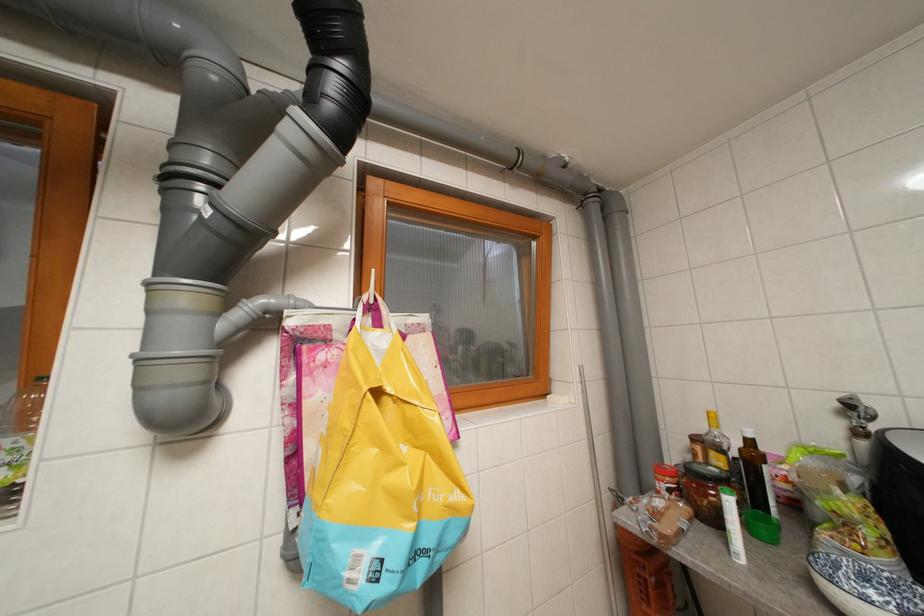
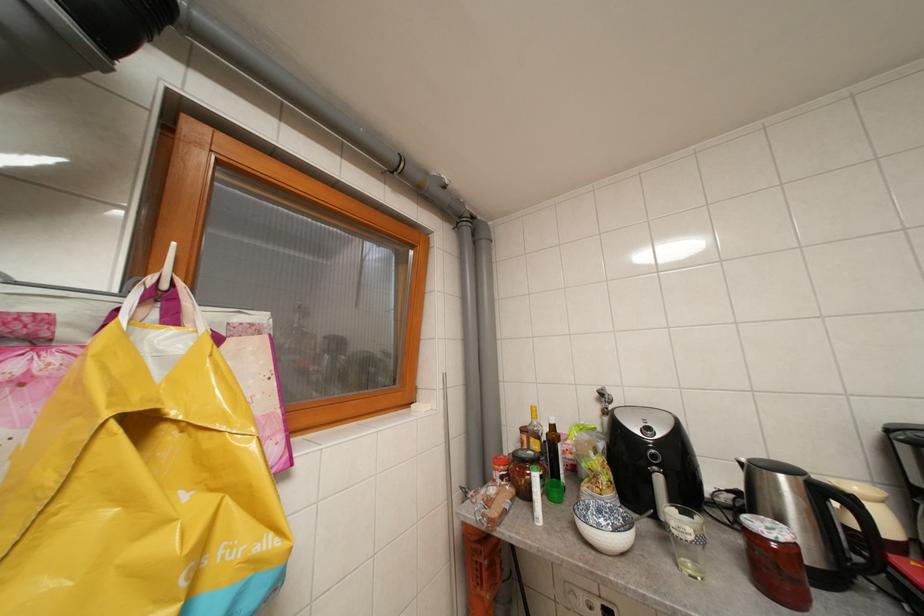
Question: The first image is from the beginning of the video and the second image is from the end. How did the camera likely rotate when shooting the video?

Choices:
 (A) Left
 (B) Right
 (C) Up
 (D) Down

Answer: (B)